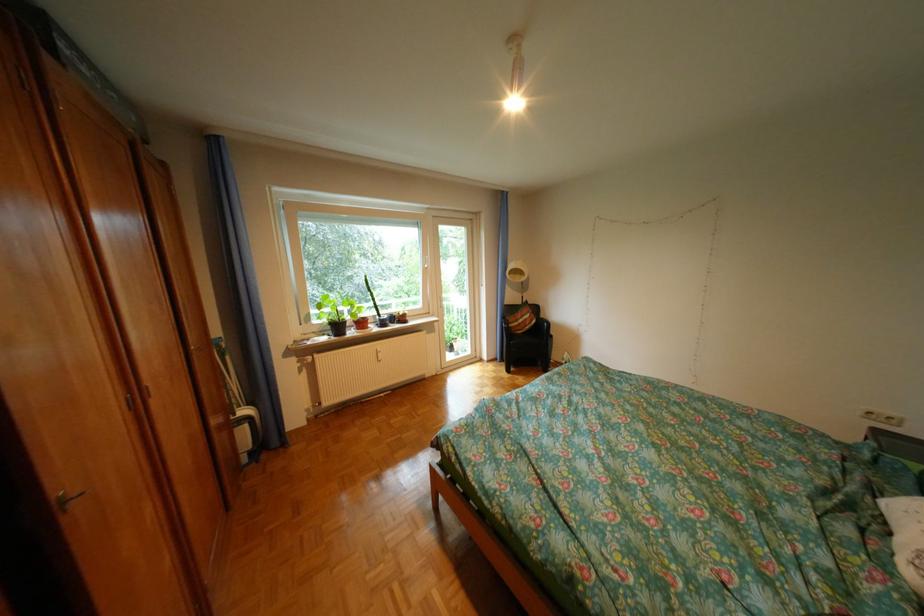
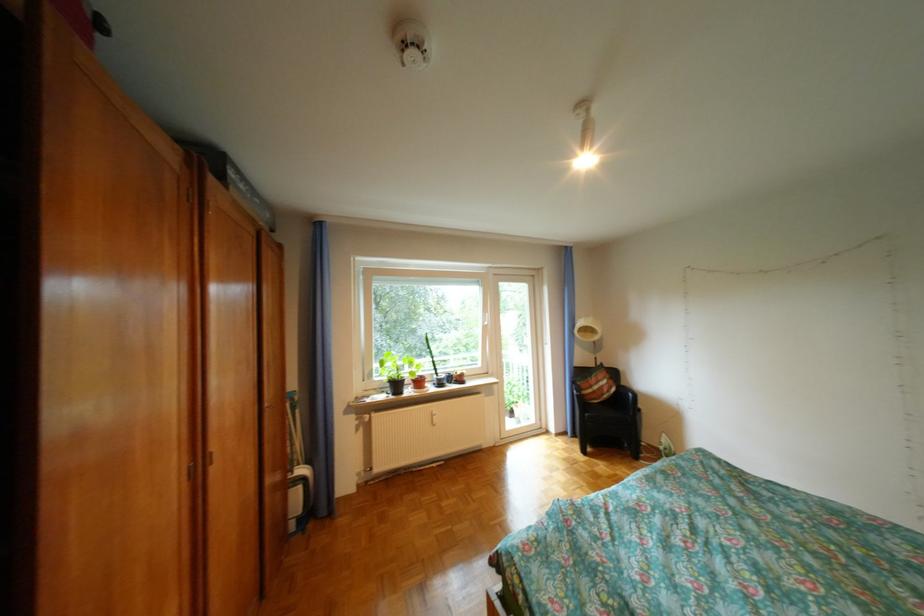
Where in the second image is the point corresponding to pixel 344 329 from the first image?

(403, 386)